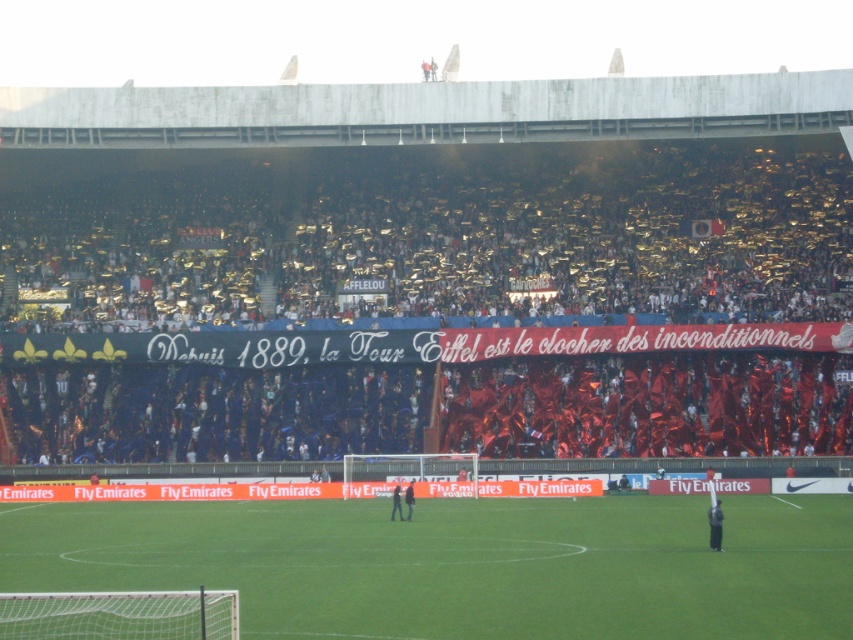
You are a drone operator trying to capture a closeup of the two jackets, dark gray fabric jacket at center and dark blue fabric jacket at center, in the same frame. The camera has a maximum focus range of 10 meters. Can you capture both jackets in focus at the same time?

The distance between the dark gray fabric jacket at center and dark blue fabric jacket at center is 9.11 meters. Since the camera can focus up to 10 meters, both jackets can be captured in focus simultaneously.

You are a photographer standing at the edge of the soccer stadium stands. You want to take a photo that includes both the dark blue fabric jacket at center and the dark blue jersey at center. The camera you are using has a maximum focus range of 14 inches. Can you capture both objects in focus without moving your position?

The distance between the dark blue fabric jacket at center and the dark blue jersey at center is 15.08 inches. Since the camera can only focus within 14 inches, you cannot capture both in focus without adjusting your position.

You are a photographer trying to capture a clear shot of both the dark gray fabric jacket at center and the dark blue jersey at center during the soccer match. Which object should you focus on first to ensure it appears in the foreground of your photo?

The dark gray fabric jacket at center is taller than the dark blue jersey at center, so focusing on the dark gray fabric jacket at center first will ensure it appears in the foreground.